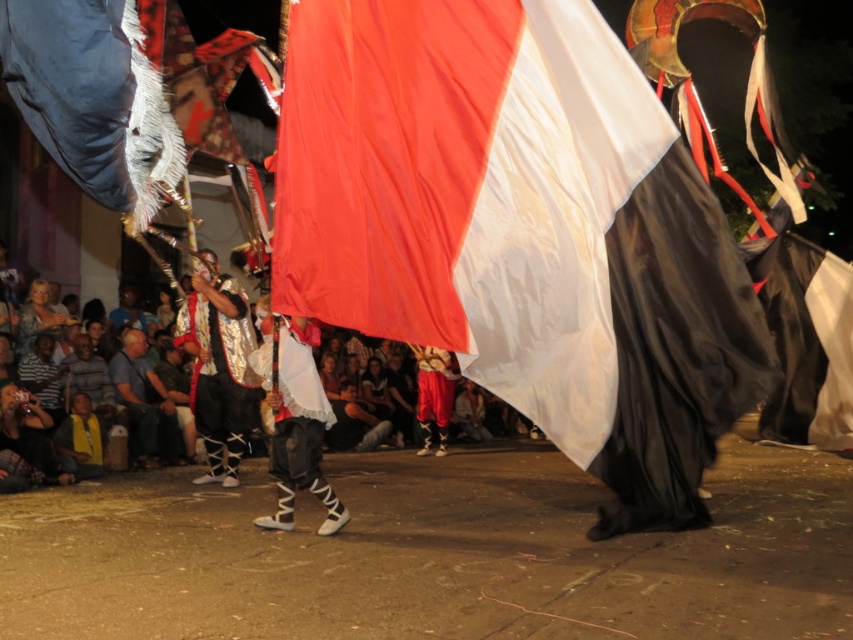
You are standing at the point marked as point (520, 228) in the image. What object are you facing directly?

The point (520, 228) corresponds to the silky red white flag at center, so you are facing the silky red white flag at center directly.